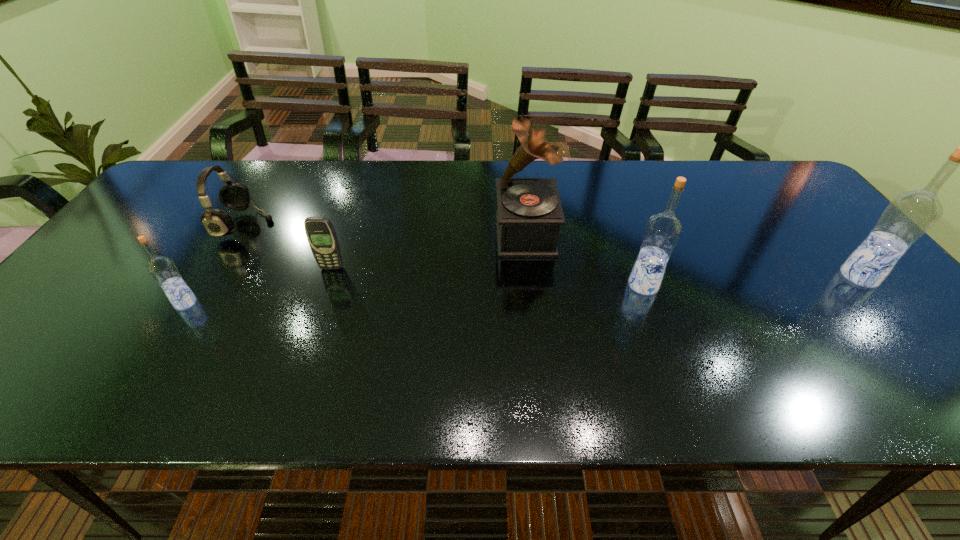
In order to click on vacant region located with the microphone on the side of the headset in this screenshot , I will do `click(322, 225)`.

Locate an element on the screen. The width and height of the screenshot is (960, 540). free space located at the horn opening of the phonograph_record is located at coordinates (423, 234).

The width and height of the screenshot is (960, 540). I want to click on vacant space located at the horn opening of the phonograph_record, so click(x=391, y=234).

Locate an element on the screen. free space located 0.190m at the horn opening of the phonograph_record is located at coordinates (427, 234).

Identify the location of vacant region located 0.230m on the screen of the cellular telephone. The height and width of the screenshot is (540, 960). (305, 345).

Image resolution: width=960 pixels, height=540 pixels. In order to click on object that is at the right edge in this screenshot , I will do `click(909, 215)`.

Locate an element on the screen. This screenshot has height=540, width=960. vacant region at the far edge of the desktop is located at coordinates (614, 189).

The height and width of the screenshot is (540, 960). Find the location of `vacant space at the near edge`. vacant space at the near edge is located at coordinates (524, 353).

I want to click on free spot at the left edge of the desktop, so click(x=102, y=308).

Locate an element on the screen. This screenshot has height=540, width=960. blank space at the right edge of the desktop is located at coordinates (758, 205).